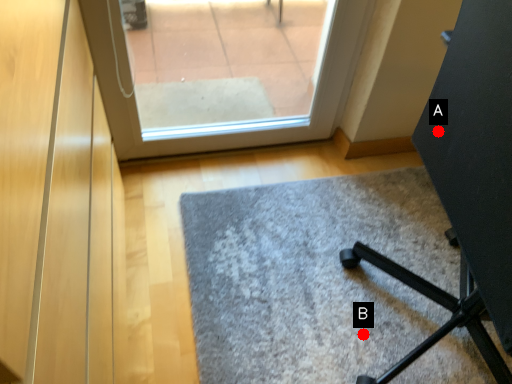
Question: Two points are circled on the image, labeled by A and B beside each circle. Which point appears farthest from the camera in this image?

Choices:
 (A) A is further
 (B) B is further

Answer: (B)